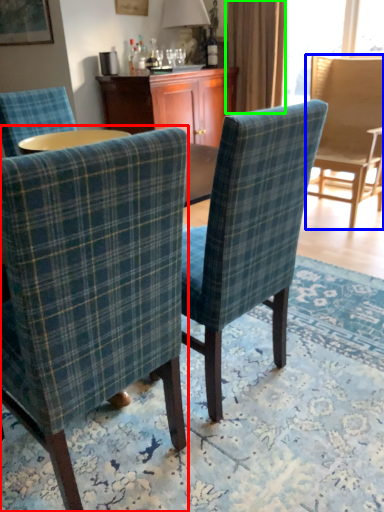
Question: Considering the real-world distances, which object is closest to chair (highlighted by a red box)? chair (highlighted by a blue box) or curtain (highlighted by a green box).

Choices:
 (A) chair
 (B) curtain

Answer: (A)